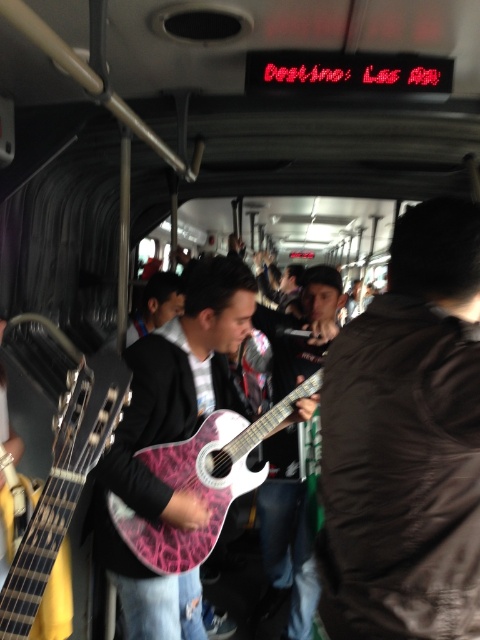
Between black leather jacket at right and pink glossy guitar at center, which one has less height?

pink glossy guitar at center is shorter.

Who is higher up, black leather jacket at right or pink glossy guitar at center?

black leather jacket at right is above.

I want to click on black leather jacket at right, so pyautogui.click(x=407, y=440).

You are a GUI agent. You are given a task and a screenshot of the screen. Output one action in this format:
    pyautogui.click(x=<x>, y=<y>)
    Task: Click on the black leather jacket at right
    The height and width of the screenshot is (640, 480).
    Given the screenshot: What is the action you would take?
    pyautogui.click(x=407, y=440)

Can you confirm if black leather jacket at right is bigger than matte black guitar at center?

Indeed, black leather jacket at right has a larger size compared to matte black guitar at center.

Does black leather jacket at right appear under matte black guitar at center?

Correct, black leather jacket at right is located below matte black guitar at center.

Identify the location of black leather jacket at right. (407, 440).

How much distance is there between pink textured guitar at center and pink glossy guitar at center?

They are 22.24 inches apart.

Between pink textured guitar at center and pink glossy guitar at center, which one is positioned lower?

pink textured guitar at center is below.

Is point (184, 548) positioned behind point (60, 444)?

Yes, point (184, 548) is farther from viewer.

At what (x,y) coordinates should I click in order to perform the action: click on pink textured guitar at center. Please return your answer as a coordinate pair (x, y). The height and width of the screenshot is (640, 480). Looking at the image, I should click on (202, 483).